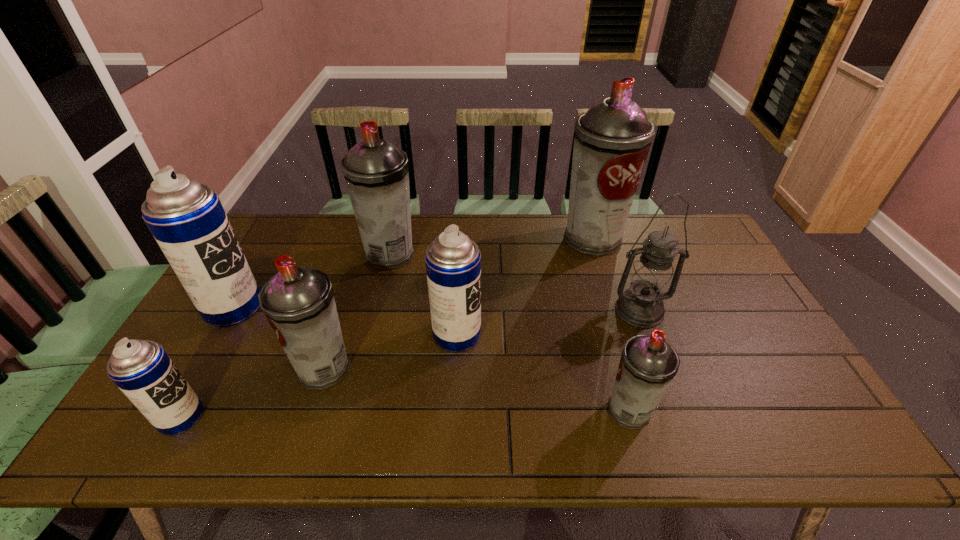
Locate an element on the screen. This screenshot has height=540, width=960. vacant space situated 0.300m on the left of the tallest aerosol can is located at coordinates (473, 238).

Where is `vacant area located on the label side of the biggest blue aerosol can`? vacant area located on the label side of the biggest blue aerosol can is located at coordinates (316, 307).

The image size is (960, 540). What are the coordinates of `blank area located 0.280m on the right of the third smallest gray aerosol can` in the screenshot? It's located at (502, 254).

Locate an element on the screen. The height and width of the screenshot is (540, 960). vacant space situated on the right of the oil lamp is located at coordinates (691, 310).

Find the location of a particular element. The width and height of the screenshot is (960, 540). vacant area situated 0.110m on the left of the third biggest gray aerosol can is located at coordinates (252, 368).

This screenshot has width=960, height=540. I want to click on free point located 0.050m on the label side of the fifth object from left to right, so click(499, 334).

Locate an element on the screen. blank space located on the label side of the smallest blue aerosol can is located at coordinates (335, 417).

Identify the location of free space located on the right of the smallest gray aerosol can. Image resolution: width=960 pixels, height=540 pixels. (809, 410).

Where is `object that is positioned at the near left corner`? This screenshot has height=540, width=960. object that is positioned at the near left corner is located at coordinates (142, 370).

The height and width of the screenshot is (540, 960). I want to click on vacant area at the far edge of the desktop, so click(560, 231).